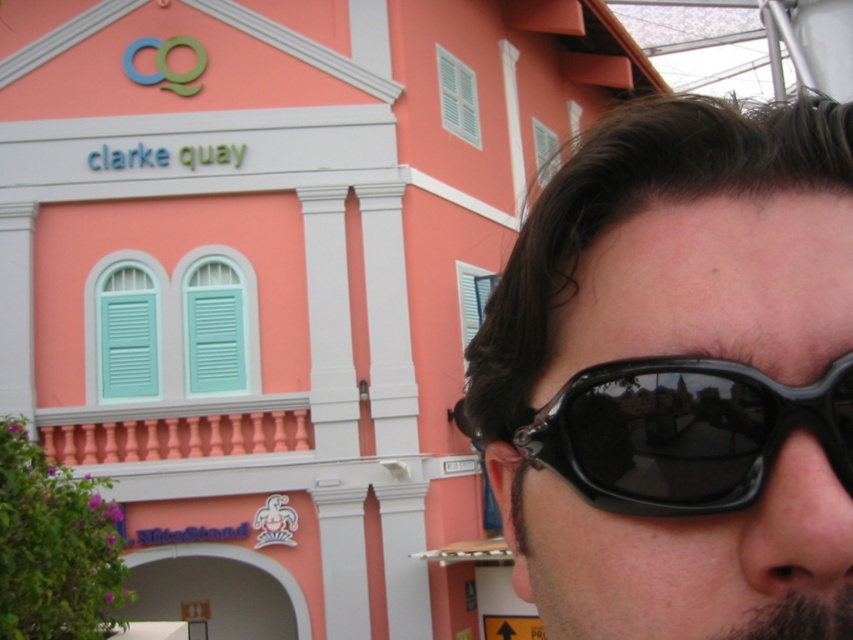
Question: Can you confirm if black plastic sunglasses at upper right is positioned to the right of black plastic goggles at right?

Choices:
 (A) no
 (B) yes

Answer: (A)

Question: Among these objects, which one is nearest to the camera?

Choices:
 (A) black plastic sunglasses at upper right
 (B) black plastic goggles at right

Answer: (A)

Question: Does black plastic sunglasses at upper right appear on the right side of black plastic goggles at right?

Choices:
 (A) yes
 (B) no

Answer: (B)

Question: Which point is farther from the camera taking this photo?

Choices:
 (A) coord(627,477)
 (B) coord(769,464)

Answer: (A)

Question: Does black plastic sunglasses at upper right appear on the left side of black plastic goggles at right?

Choices:
 (A) no
 (B) yes

Answer: (B)